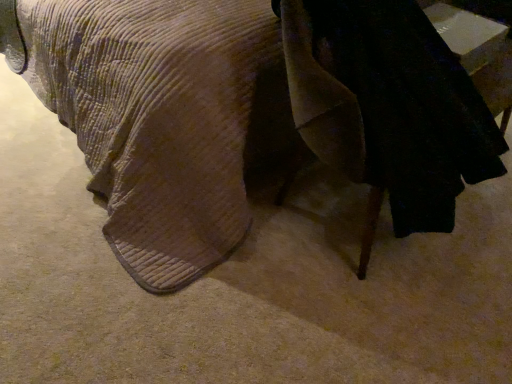
The image size is (512, 384). I want to click on black fabric robe at lower right, so click(x=389, y=105).

Image resolution: width=512 pixels, height=384 pixels. Describe the element at coordinates (389, 105) in the screenshot. I see `black fabric robe at lower right` at that location.

Identify the location of black fabric robe at lower right. (389, 105).